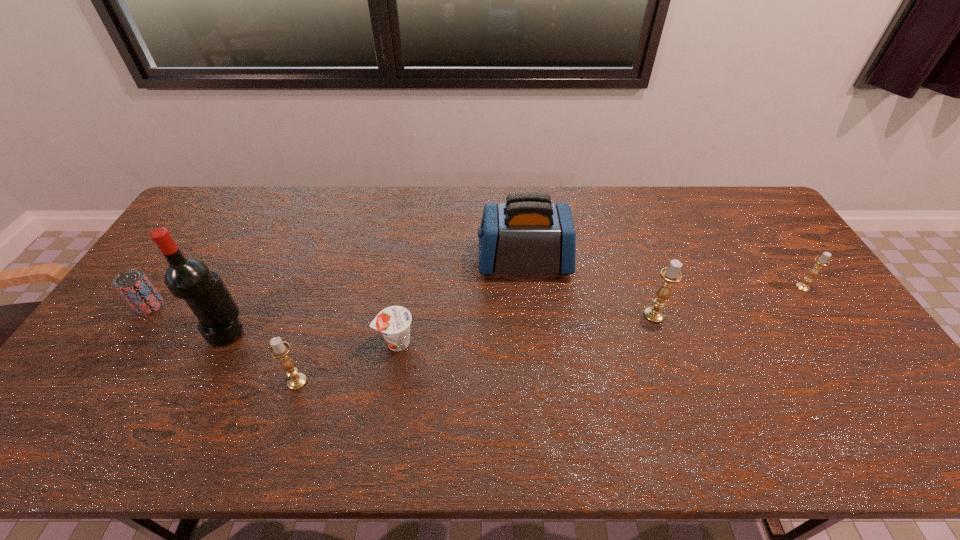
Locate an element on the screen. This screenshot has height=540, width=960. vacant region located 0.200m on the front-facing side of the farthest object is located at coordinates (415, 261).

Find the location of `vacant position located 0.370m on the front-facing side of the farthest object`. vacant position located 0.370m on the front-facing side of the farthest object is located at coordinates (361, 261).

I want to click on free location located on the front-facing side of the farthest object, so click(373, 261).

Identify the location of object at the near edge. (279, 349).

The image size is (960, 540). I want to click on object that is at the left edge, so click(133, 285).

Where is `object located at the right edge`? object located at the right edge is located at coordinates (821, 261).

I want to click on vacant space at the far edge of the desktop, so click(338, 195).

Find the location of `free region at the near edge of the desktop`. free region at the near edge of the desktop is located at coordinates (780, 399).

In the image, there is a desktop. Where is `vacant space at the left edge`? vacant space at the left edge is located at coordinates (194, 240).

The width and height of the screenshot is (960, 540). In the image, there is a desktop. Find the location of `vacant space at the far left corner`. vacant space at the far left corner is located at coordinates (228, 212).